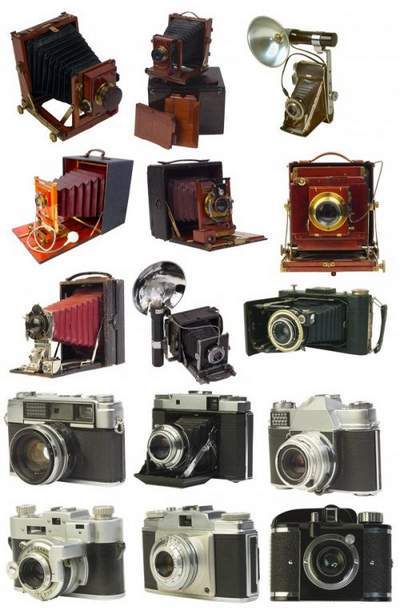
Find the location of a particular element. This screenshot has width=400, height=610. knobs is located at coordinates (102, 512), (27, 507), (233, 512), (374, 515), (285, 404), (200, 390), (104, 398), (358, 292), (335, 95).